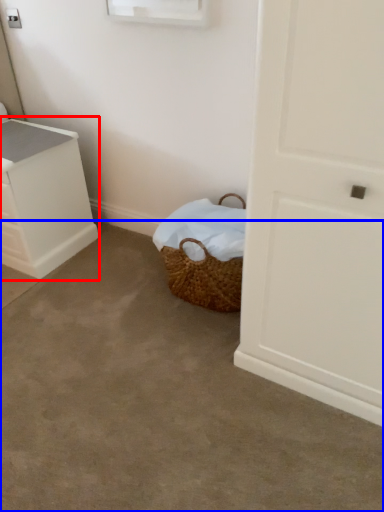
Question: Which point is further to the camera, chest of drawers (highlighted by a red box) or concrete (highlighted by a blue box)?

Choices:
 (A) chest of drawers
 (B) concrete

Answer: (A)